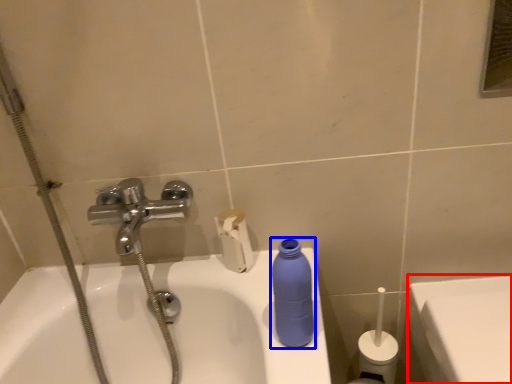
Question: Which of the following is the closest to the observer, porcelain (highlighted by a red box) or cleaning product (highlighted by a blue box)?

Choices:
 (A) porcelain
 (B) cleaning product

Answer: (B)